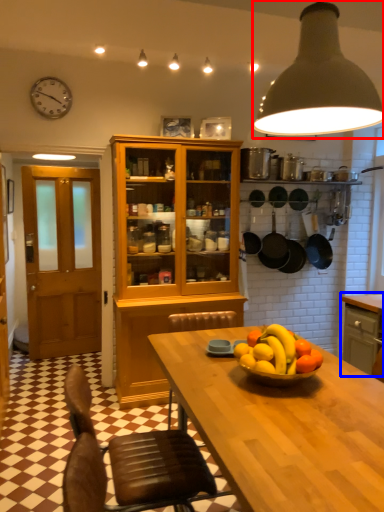
Question: Which of the following is the closest to the observer, light (highlighted by a red box) or cabinetry (highlighted by a blue box)?

Choices:
 (A) light
 (B) cabinetry

Answer: (A)